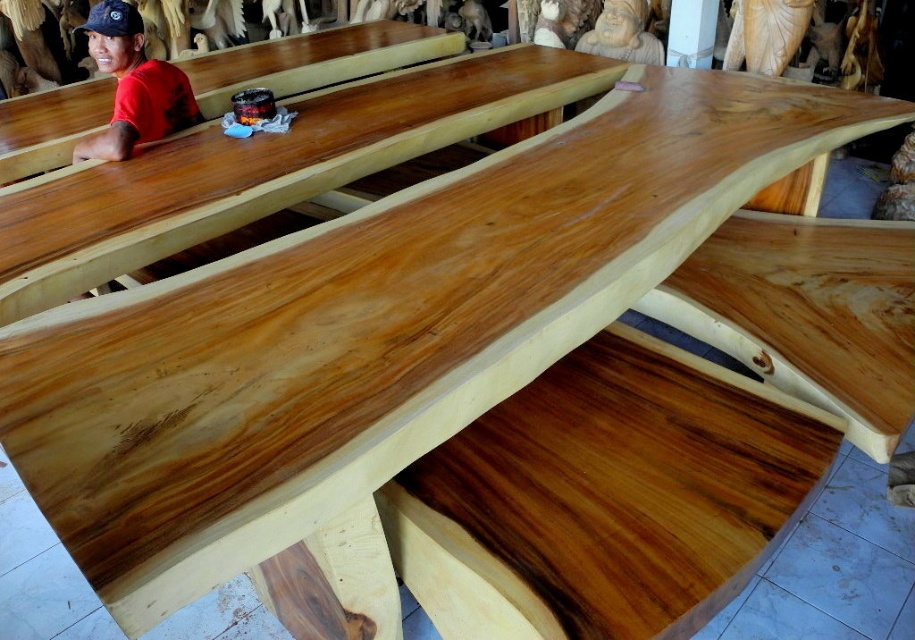
You are an artisan working in the workshop and need to place the polished wood plank at center onto the natural wood table at left. Considering their widths, will the plank fit entirely on the table without overhanging the edges?

The polished wood plank at center is narrower than the natural wood table at left, so it will fit entirely on the table without overhanging the edges.

You are a carpenter working in the workshop. You need to place a small tool on the surface that is higher. Which object should you choose between the natural wood table at left and the matte brown statue at upper center?

The natural wood table at left is taller than the matte brown statue at upper center, so you should place the small tool on the natural wood table at left.

You are standing in the workshop and see two points marked on the floor. The first point is at coordinates point (9, 102) and the second is at point (131, 33). Which point is closer to you?

Point (9, 102) is closer to you because it is further to the viewer than point (131, 33).